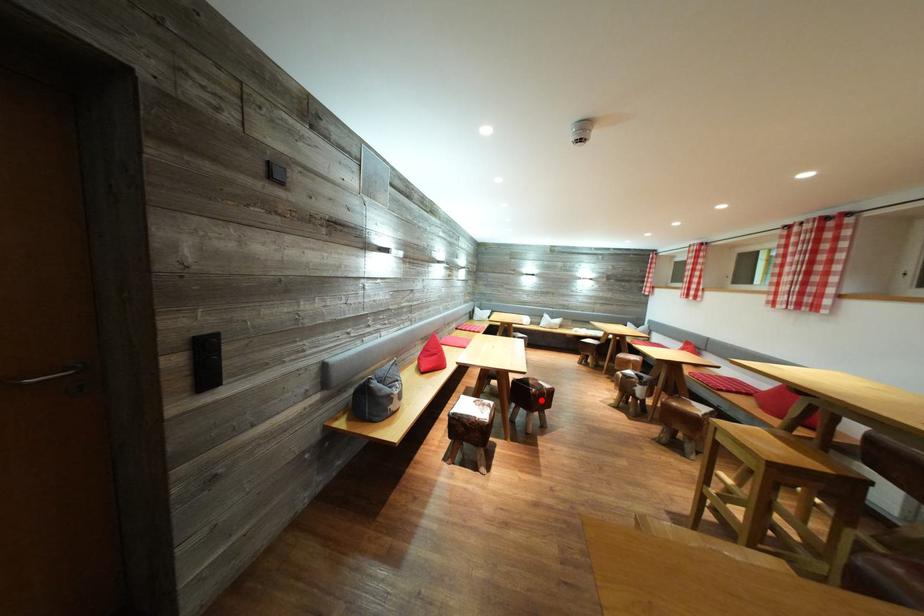
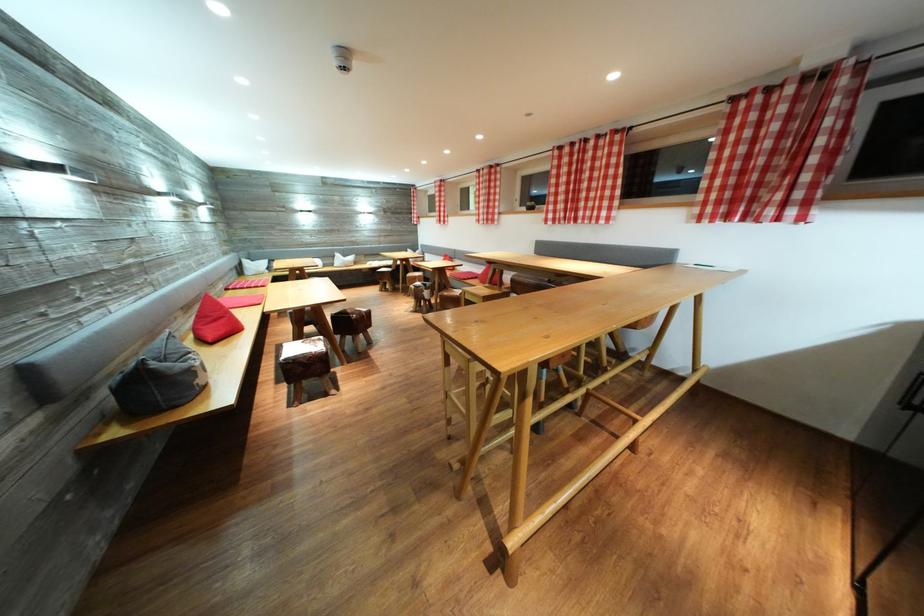
Question: I am providing you with two images of the same scene from different viewpoints. In image1, a red point is highlighted. Considering the same 3D point in image2, which of the following is correct?

Choices:
 (A) It is closer
 (B) It is farther

Answer: (A)